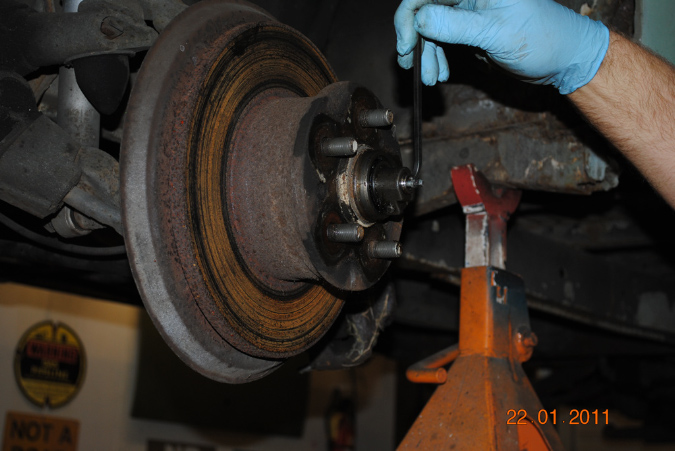
Image resolution: width=675 pixels, height=451 pixels. In order to click on handles in this screenshot , I will do `click(428, 356)`, `click(416, 88)`.